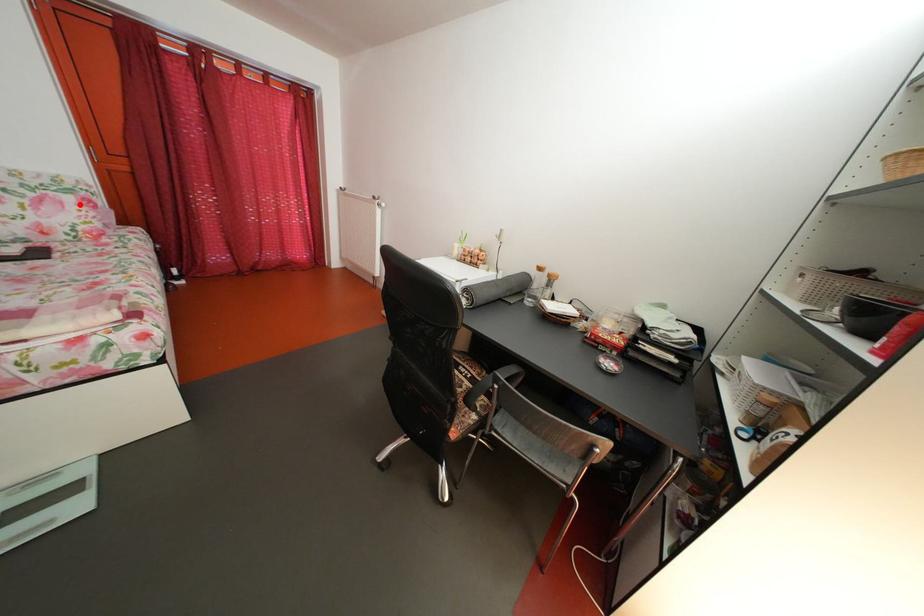
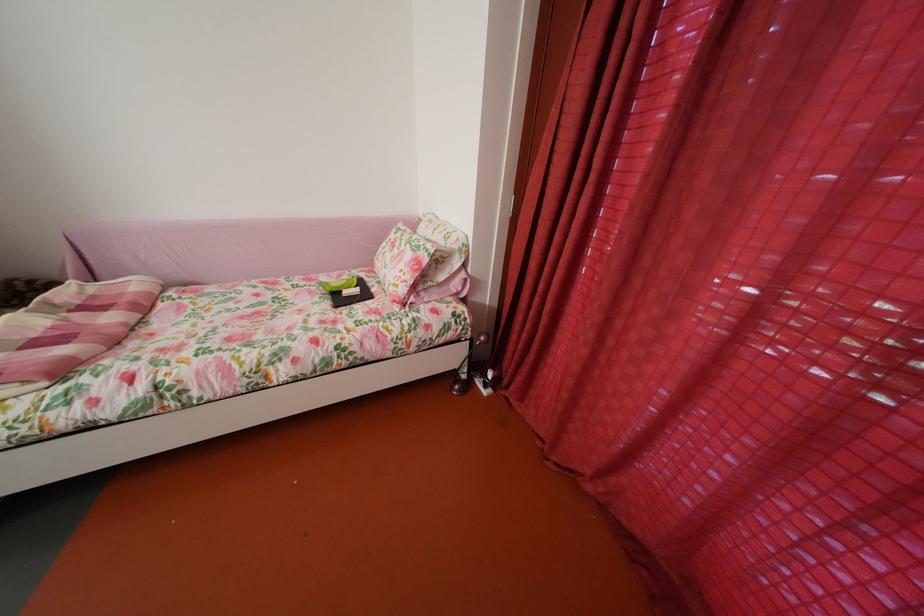
Question: I am providing you with two images of the same scene from different viewpoints. Given a red point in image1, look at the same physical point in image2. Is it:

Choices:
 (A) Closer to the viewpoint
 (B) Farther from the viewpoint

Answer: (A)